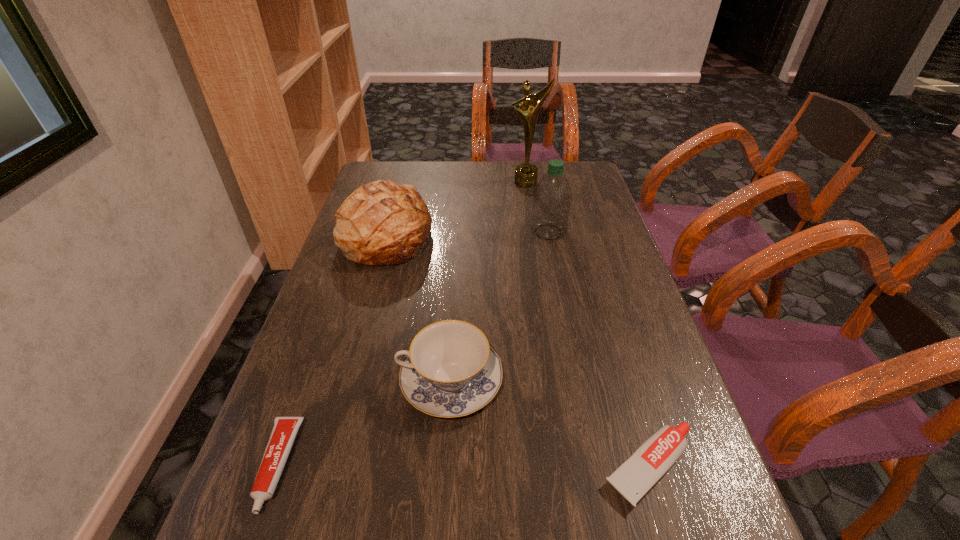
Identify the location of toothpaste located at the right edge. tap(635, 477).

The image size is (960, 540). In the image, there is a desktop. In order to click on vacant area at the far edge in this screenshot , I will do `click(472, 167)`.

This screenshot has width=960, height=540. In the image, there is a desktop. Find the location of `vacant space at the left edge`. vacant space at the left edge is located at coordinates (290, 403).

Locate an element on the screen. Image resolution: width=960 pixels, height=540 pixels. free space at the right edge of the desktop is located at coordinates (564, 249).

This screenshot has width=960, height=540. In the image, there is a desktop. Find the location of `blank space at the far left corner`. blank space at the far left corner is located at coordinates (370, 177).

Where is `vacant area that lies between the taller toothpaste and the fourth shortest object`? The width and height of the screenshot is (960, 540). vacant area that lies between the taller toothpaste and the fourth shortest object is located at coordinates (518, 352).

I want to click on vacant area between the taller toothpaste and the second tallest object, so click(599, 350).

Image resolution: width=960 pixels, height=540 pixels. I want to click on vacant area that lies between the tallest object and the shortest object, so click(401, 323).

Where is `empty space that is in between the taller toothpaste and the left toothpaste`? The image size is (960, 540). empty space that is in between the taller toothpaste and the left toothpaste is located at coordinates (464, 467).

The image size is (960, 540). Identify the location of empty space that is in between the third tallest object and the water bottle. (468, 234).